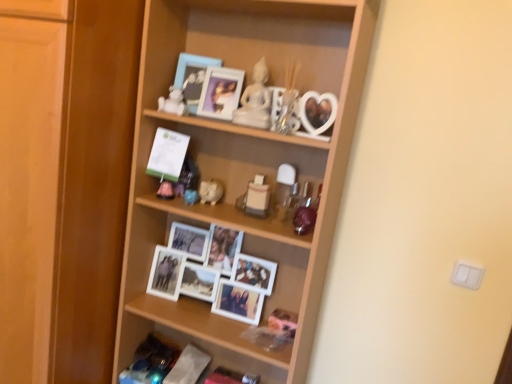
Question: Is point (220, 187) closer or farther from the camera than point (243, 198)?

Choices:
 (A) farther
 (B) closer

Answer: (A)

Question: In the image, is white glossy piggy bank at center, the second toy positioned from the bottom, on the left side or the right side of matte plastic toy at center, which ranks as the 1th toy in bottom-to-top order?

Choices:
 (A) left
 (B) right

Answer: (A)

Question: Which object is positioned farthest from the matte blue picture frame at upper center, which is the second picture frame from right to left?

Choices:
 (A) matte plastic picture frame at upper center, marked as the second picture frame in a left-to-right arrangement
 (B) white glossy piggy bank at center, placed as the 4th toy when sorted from top to bottom
 (C) wooden shelf at center, which is counted as the 1th shelf, starting from the top
 (D) matte plastic toy at center, the third toy ordered from the bottom
 (E) wooden cabinet at left

Answer: (E)

Question: Which object is positioned closest to the white glossy statue at upper center, the 5th toy positioned from the bottom?

Choices:
 (A) wooden cabinet at left
 (B) matte plastic toy at center, the third toy ordered from the bottom
 (C) white matte figurine at upper center, which is counted as the 2th toy, starting from the top
 (D) matte blue picture frame at upper center, the 1th picture frame from the left
 (E) matte plastic picture frame at upper center, which is counted as the 1th picture frame, starting from the right

Answer: (E)